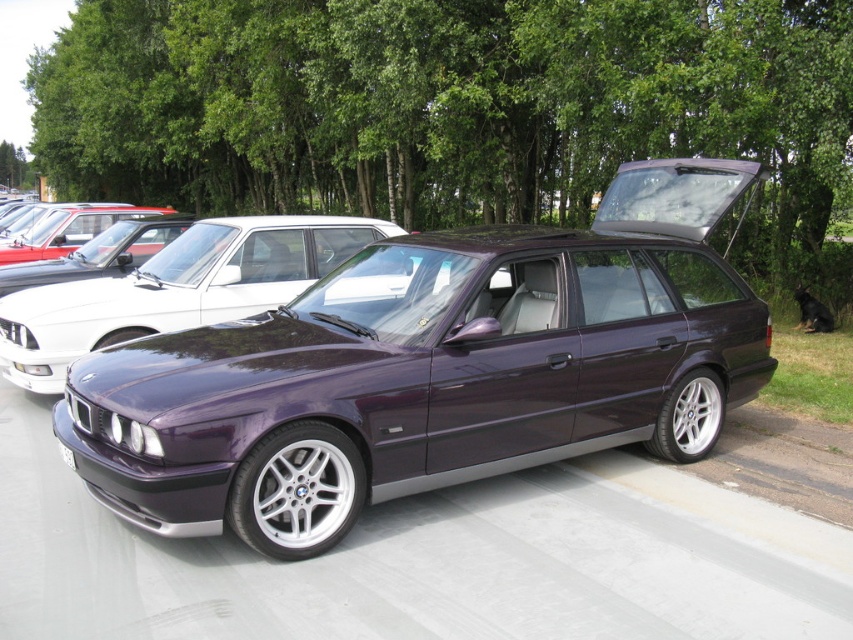
Question: Which object is closer to the camera taking this photo?

Choices:
 (A) matte black car at center
 (B) purple metallic car at center
 (C) shiny purple car at center

Answer: (B)

Question: Which point is closer to the camera?

Choices:
 (A) matte black car at center
 (B) shiny purple car at center

Answer: (B)

Question: Which object is the closest to the matte black car at center?

Choices:
 (A) purple metallic car at center
 (B) shiny purple car at center

Answer: (B)

Question: From the image, what is the correct spatial relationship of shiny purple car at center in relation to matte black car at center?

Choices:
 (A) above
 (B) below

Answer: (B)

Question: Is shiny purple car at center closer to the viewer compared to matte black car at center?

Choices:
 (A) yes
 (B) no

Answer: (A)

Question: Does purple metallic car at center have a smaller size compared to matte black car at center?

Choices:
 (A) no
 (B) yes

Answer: (B)